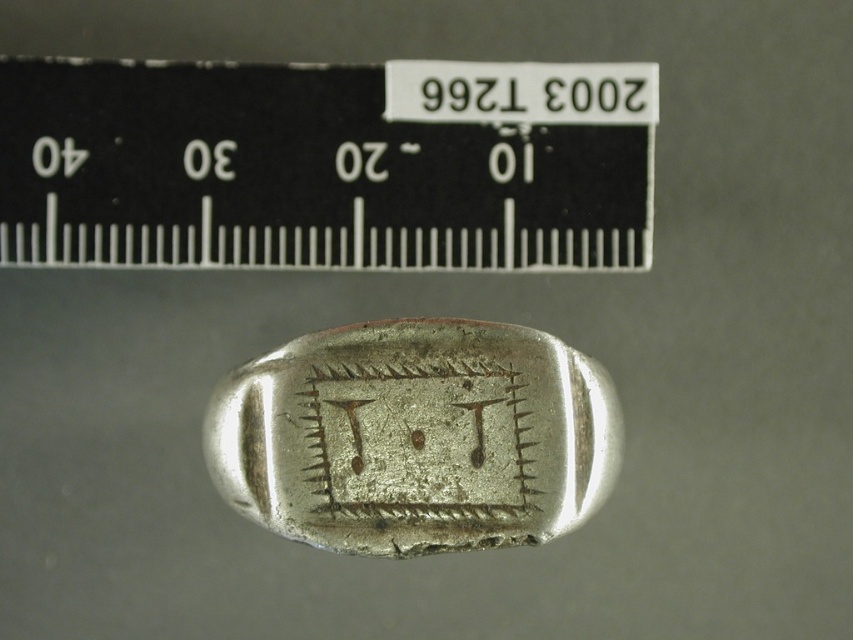
Is black plastic ruler at upper center thinner than shiny silver ring at center?

In fact, black plastic ruler at upper center might be wider than shiny silver ring at center.

Is black plastic ruler at upper center above shiny silver ring at center?

Yes.

In order to click on black plastic ruler at upper center in this screenshot , I will do `click(326, 164)`.

Where is `black plastic ruler at upper center`? Image resolution: width=853 pixels, height=640 pixels. black plastic ruler at upper center is located at coordinates tap(326, 164).